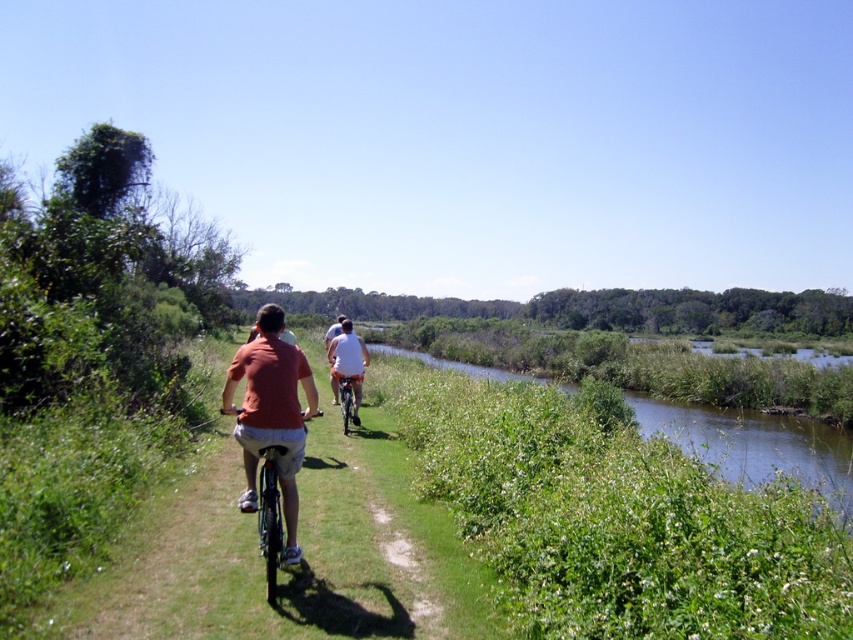
In the scene shown: Which of these two, green grassy waterway at right or white matte shirt at center, stands shorter?

Standing shorter between the two is white matte shirt at center.

Is point (456, 369) positioned behind point (360, 339)?

Yes, it is.

Does point (846, 497) lie in front of point (349, 360)?

Yes, it is.

Locate an element on the screen. This screenshot has width=853, height=640. green grassy waterway at right is located at coordinates (755, 444).

Between point (277, 460) and point (337, 380), which one is positioned behind?

The point (337, 380) is behind.

Locate an element on the screen. orange t-shirt at center is located at coordinates (271, 413).

Locate an element on the screen. orange t-shirt at center is located at coordinates (271, 413).

Is point (784, 458) behind point (259, 388)?

Yes.

Looking at this image, can you confirm if green grassy waterway at right is positioned above orange t-shirt at center?

No.

Is point (735, 412) positioned after point (262, 372)?

Yes, point (735, 412) is farther from viewer.

Find the location of a particular element. Image resolution: width=853 pixels, height=640 pixels. green grassy waterway at right is located at coordinates (755, 444).